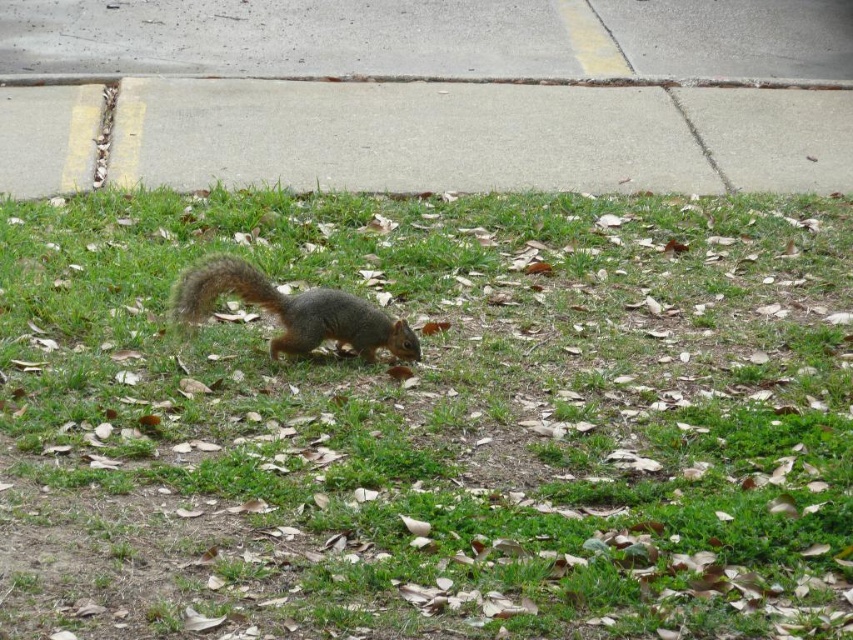
You are standing at the origin point of the image coordinate system. Which direction should you move to reach the green grass at center?

The green grass at center is located at coordinate point 0.659 on the x axis and 0.505 on the y axis. Since you are at the origin point, you should move towards the positive x and y directions to reach it.

You are a delivery robot with a 12 feet long package. You need to move from the gray concrete curb at upper center to the fuzzy brown tail at center. Can you fit the package between them without bending it?

The distance between the gray concrete curb at upper center and the fuzzy brown tail at center is 11.56 feet, which is shorter than the 12 feet long package. Therefore, the package cannot fit between them without bending.